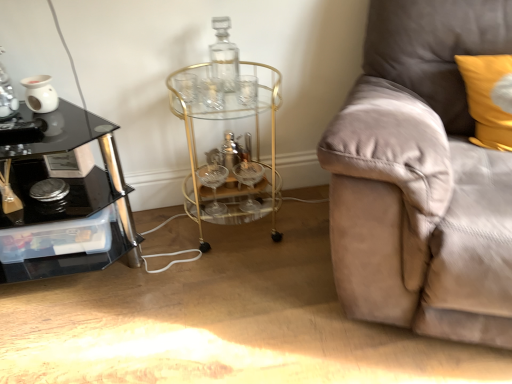
Question: Considering the relative positions of black glass table at left and yellow fabric pillow at upper right in the image provided, is black glass table at left behind yellow fabric pillow at upper right?

Choices:
 (A) no
 (B) yes

Answer: (B)

Question: From a real-world perspective, is black glass table at left below yellow fabric pillow at upper right?

Choices:
 (A) no
 (B) yes

Answer: (B)

Question: Is black glass table at left turned away from yellow fabric pillow at upper right?

Choices:
 (A) no
 (B) yes

Answer: (A)

Question: Can you confirm if black glass table at left is wider than yellow fabric pillow at upper right?

Choices:
 (A) no
 (B) yes

Answer: (B)

Question: Is black glass table at left closer to the viewer compared to yellow fabric pillow at upper right?

Choices:
 (A) yes
 (B) no

Answer: (B)

Question: From their relative heights in the image, would you say black glass table at left is taller or shorter than suede couch at right?

Choices:
 (A) tall
 (B) short

Answer: (B)

Question: Does point (18, 147) appear closer or farther from the camera than point (467, 9)?

Choices:
 (A) farther
 (B) closer

Answer: (B)

Question: Considering the positions of black glass table at left and suede couch at right in the image, is black glass table at left wider or thinner than suede couch at right?

Choices:
 (A) wide
 (B) thin

Answer: (B)

Question: Based on their sizes in the image, would you say black glass table at left is bigger or smaller than suede couch at right?

Choices:
 (A) small
 (B) big

Answer: (A)

Question: Considering the positions of gold metallic bar cart at center and black glass table at left in the image, is gold metallic bar cart at center wider or thinner than black glass table at left?

Choices:
 (A) thin
 (B) wide

Answer: (A)

Question: Considering the positions of gold metallic bar cart at center and black glass table at left in the image, is gold metallic bar cart at center taller or shorter than black glass table at left?

Choices:
 (A) tall
 (B) short

Answer: (A)

Question: From a real-world perspective, is gold metallic bar cart at center positioned above or below black glass table at left?

Choices:
 (A) above
 (B) below

Answer: (A)

Question: Which is correct: gold metallic bar cart at center is inside black glass table at left, or outside of it?

Choices:
 (A) inside
 (B) outside

Answer: (B)

Question: Does point (479, 92) appear closer or farther from the camera than point (231, 61)?

Choices:
 (A) closer
 (B) farther

Answer: (A)

Question: Considering the positions of yellow fabric pillow at upper right and transparent glass bottle at center in the image, is yellow fabric pillow at upper right taller or shorter than transparent glass bottle at center?

Choices:
 (A) short
 (B) tall

Answer: (B)